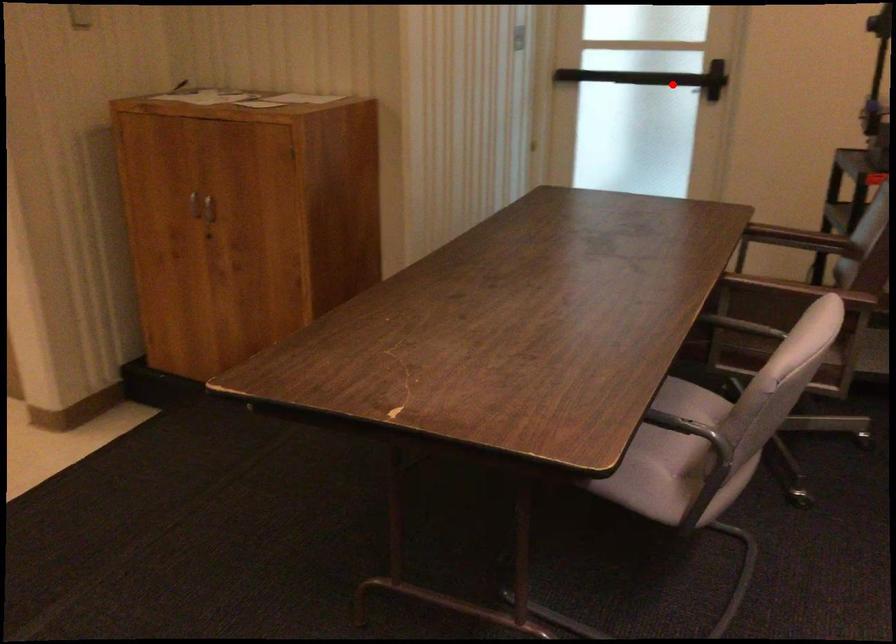
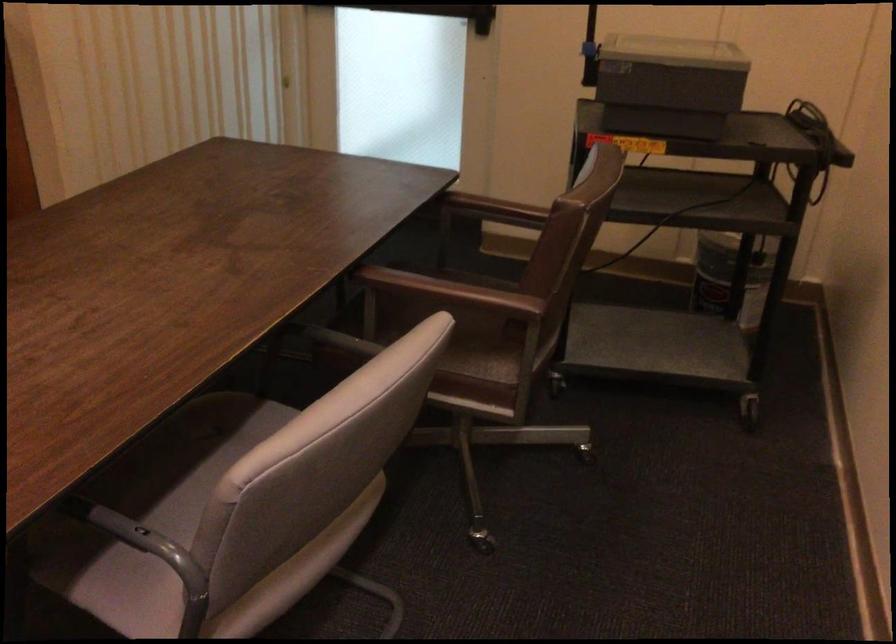
Question: I am providing you with two images of the same scene from different viewpoints. A red point is shown in image1. For the corresponding object point in image2, is it positioned nearer or farther from the camera?

Choices:
 (A) Nearer
 (B) Farther

Answer: (A)